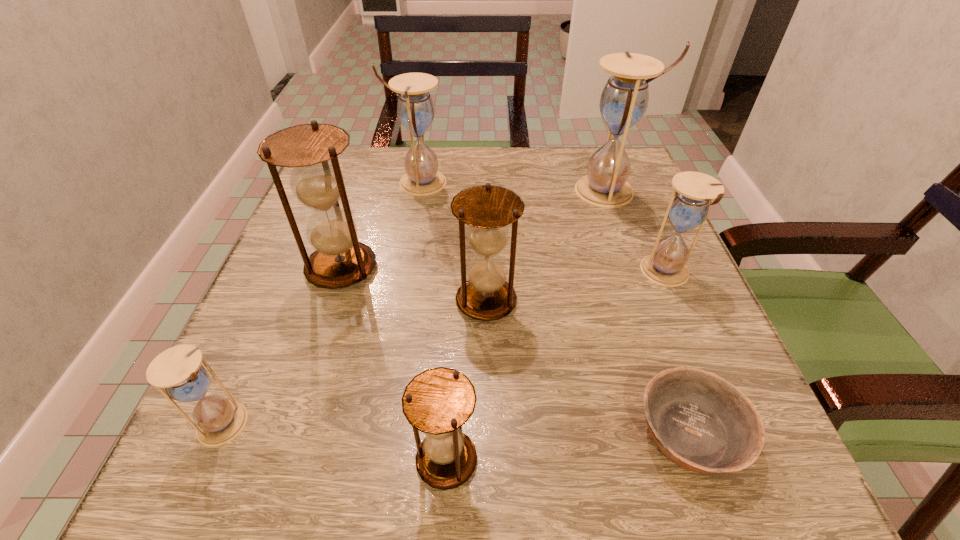
Identify the location of blank space located on the front of the tallest object. (665, 344).

Where is `blank space located 0.260m on the front of the biggest brown hourglass`? This screenshot has height=540, width=960. blank space located 0.260m on the front of the biggest brown hourglass is located at coordinates (x=289, y=431).

This screenshot has height=540, width=960. What are the coordinates of `vacant space located on the right of the second white hourglass from left to right` in the screenshot? It's located at (607, 183).

This screenshot has width=960, height=540. Find the location of `vacant space located on the right of the second biggest brown hourglass`. vacant space located on the right of the second biggest brown hourglass is located at coordinates (562, 301).

Locate an element on the screen. free space located on the back of the second nearest white hourglass is located at coordinates (634, 198).

Image resolution: width=960 pixels, height=540 pixels. What are the coordinates of `vacant space positioned 0.130m on the right of the nearest white hourglass` in the screenshot? It's located at (345, 423).

Image resolution: width=960 pixels, height=540 pixels. Identify the location of vacant space situated on the back of the nearest brown hourglass. (455, 293).

The height and width of the screenshot is (540, 960). What are the coordinates of `vacant area located 0.270m on the back of the bowl` in the screenshot? It's located at (631, 263).

Locate an element on the screen. bowl present at the near edge is located at coordinates (700, 421).

The height and width of the screenshot is (540, 960). What are the coordinates of `bowl present at the right edge` in the screenshot? It's located at (700, 421).